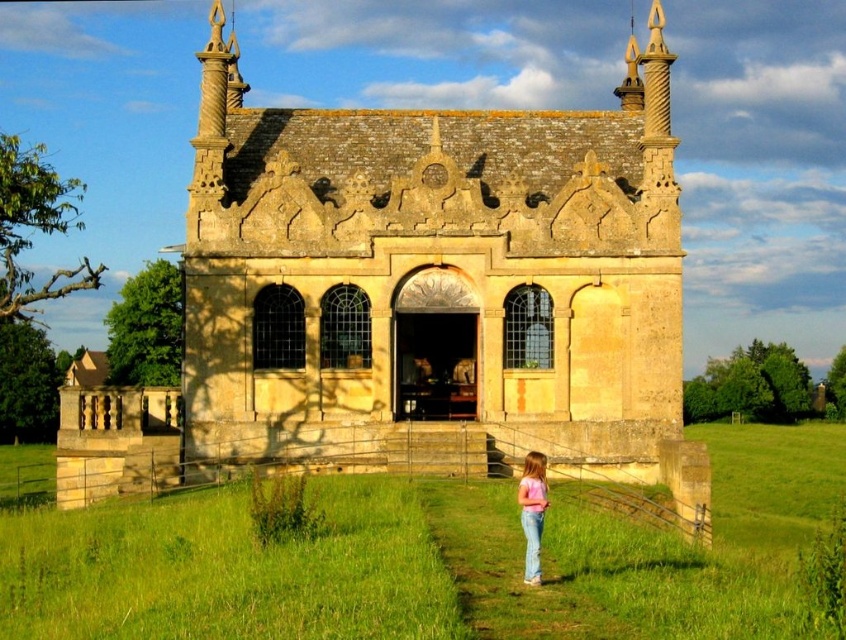
You are a photographer planning to capture a photo of the yellow stone church at center and the pink cotton shirt at lower center. Since you want to emphasize the size difference between them, which object should you position closer to the camera to make it appear larger?

To emphasize the size difference between the yellow stone church at center and the pink cotton shirt at lower center, you should position the pink cotton shirt at lower center closer to the camera. Since the yellow stone church at center is taller in reality, moving the smaller pink cotton shirt at lower center closer will make it appear larger in the photo, creating a contrast in their apparent sizes.

You are standing in the field and want to walk to the yellow stone church at center. Which direction should you walk relative to the green grass at lower center?

You should walk towards the area above the green grass at lower center to reach the yellow stone church at center.